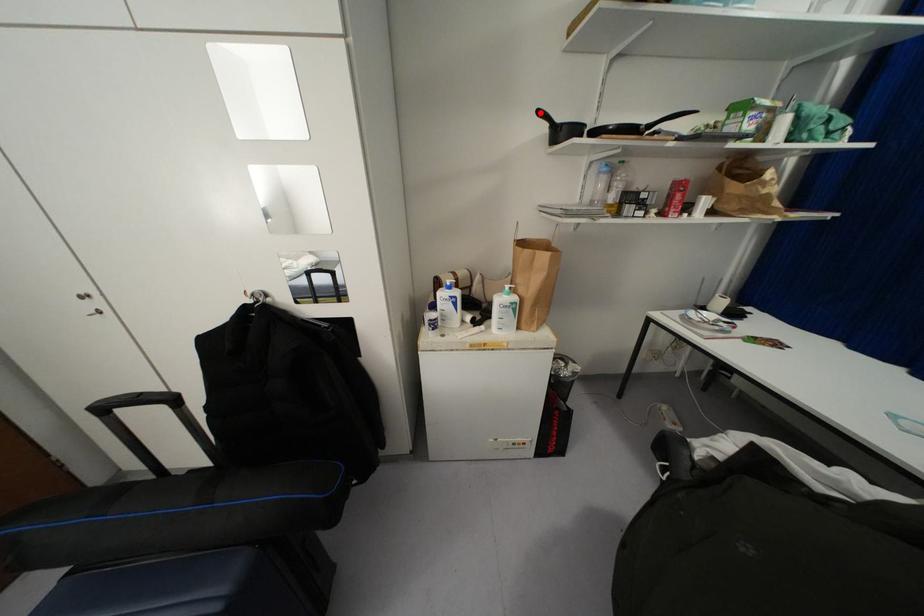
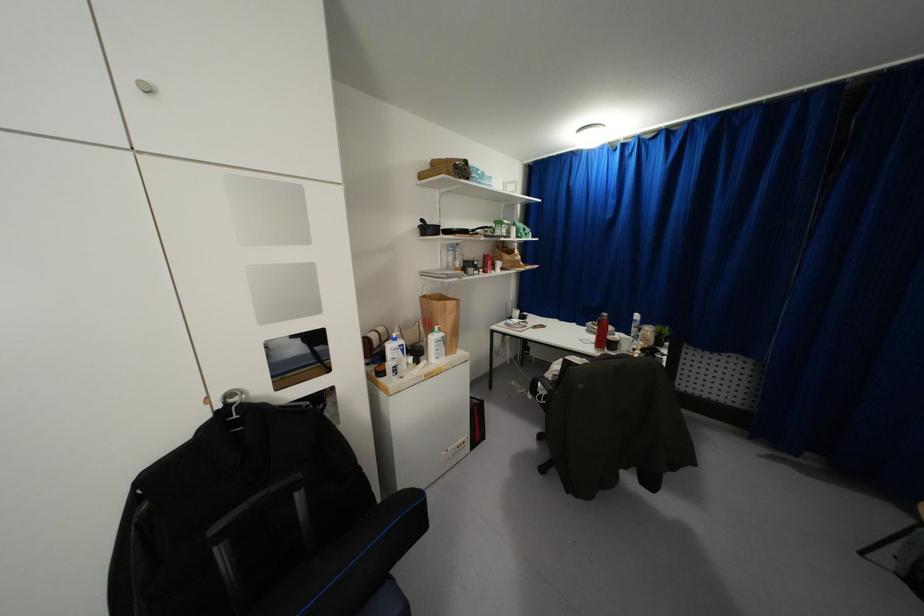
Question: I am providing you with two images of the same scene from different viewpoints. A red point is marked on the first image. At the location where the point appears in image 1, is it still visible in image 2?

Choices:
 (A) Yes
 (B) No

Answer: (A)